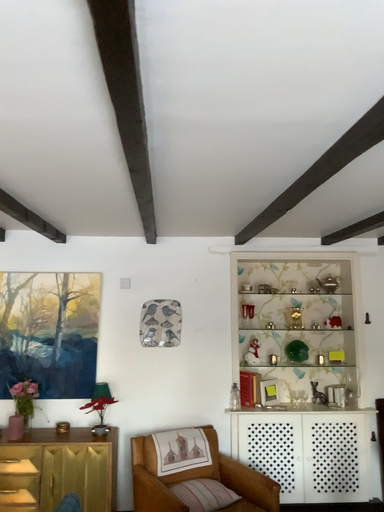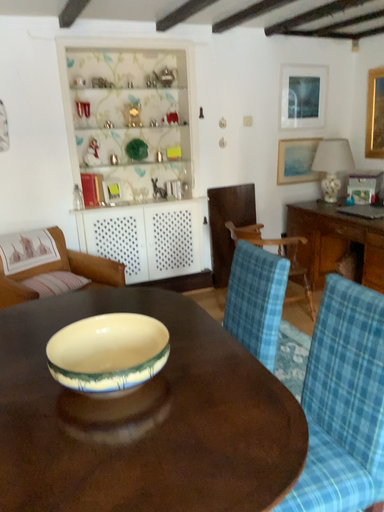
Question: Which way did the camera rotate in the video?

Choices:
 (A) rotated left
 (B) rotated right

Answer: (B)